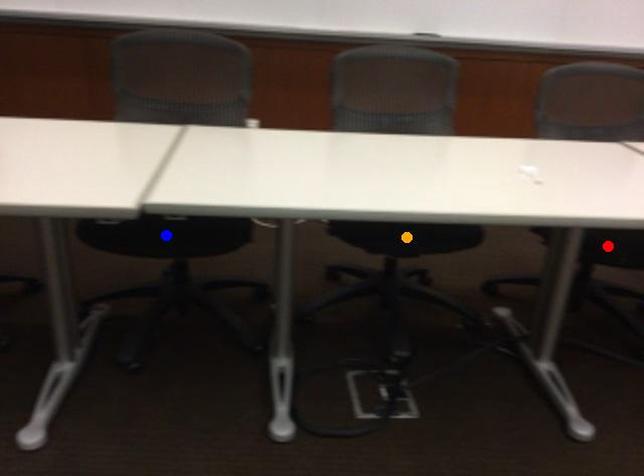
Order these from nearest to farthest:
orange point | blue point | red point

orange point, red point, blue point